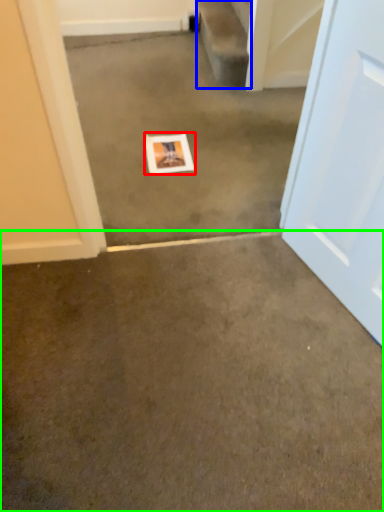
Question: Based on their relative distances, which object is farther from picture frame (highlighted by a red box)? Choose from stairwell (highlighted by a blue box) and concrete (highlighted by a green box).

Choices:
 (A) stairwell
 (B) concrete

Answer: (B)